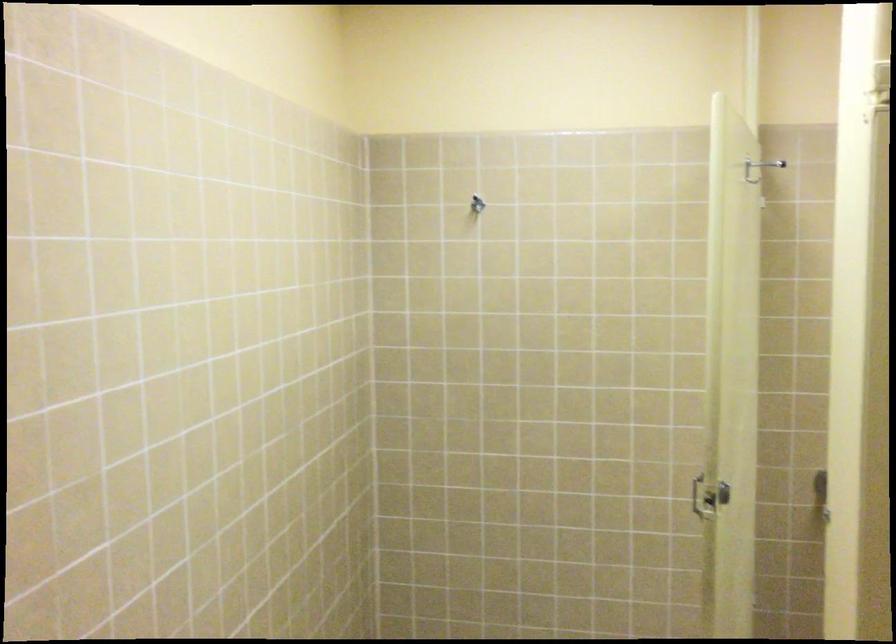
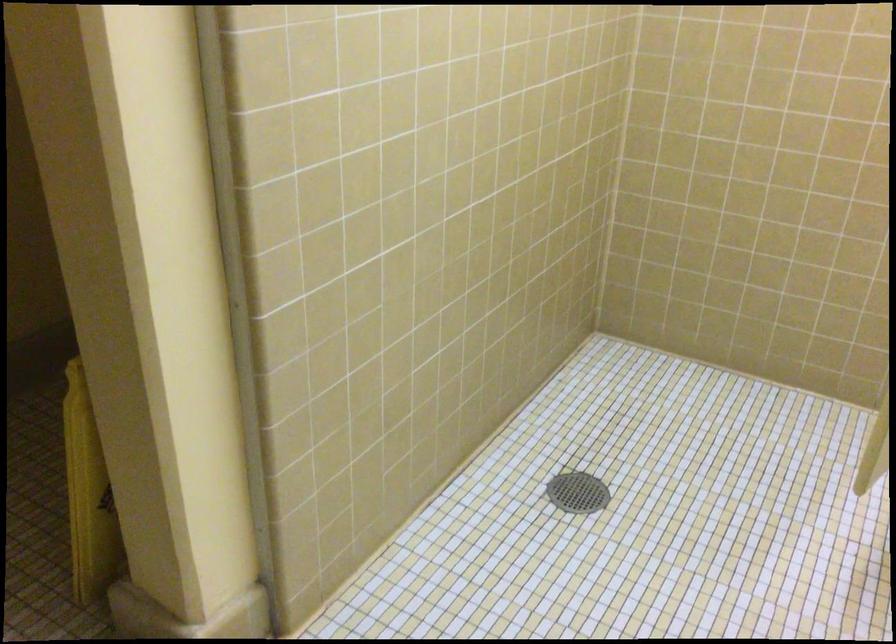
Based on the continuous images, in which direction is the camera rotating?

The rotation direction of the camera is left-down.